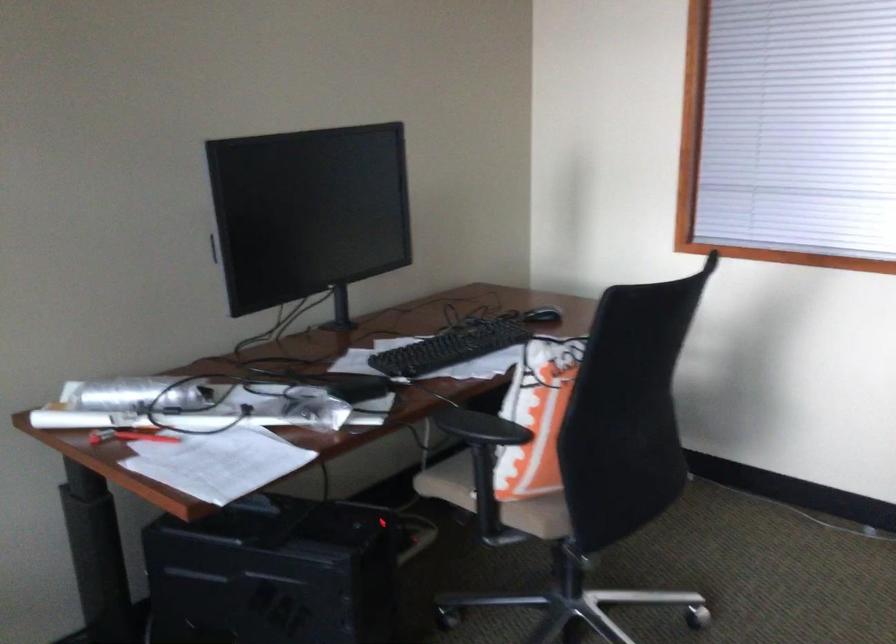
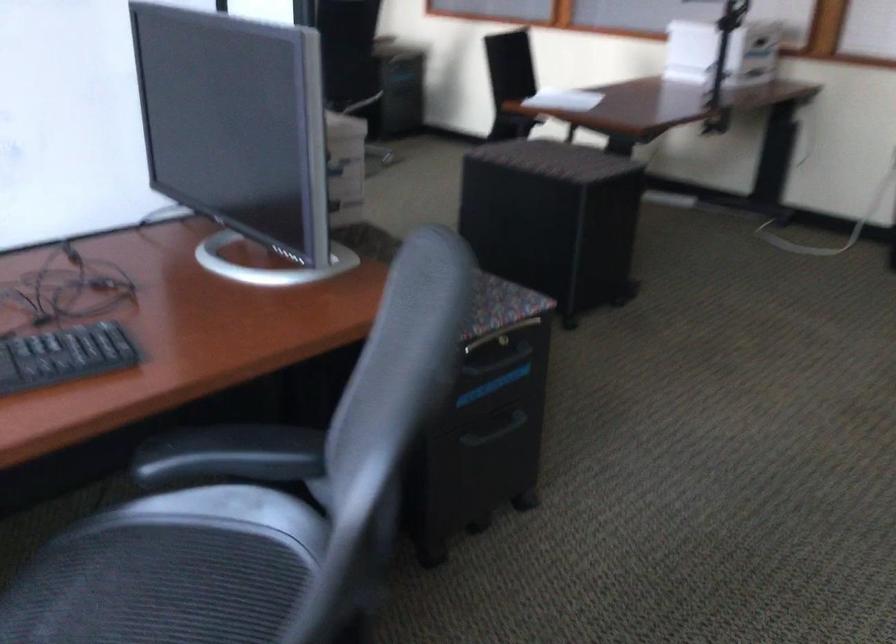
The images are taken continuously from a first-person perspective. In which direction are you moving?

The cameraman moved toward right, backward.